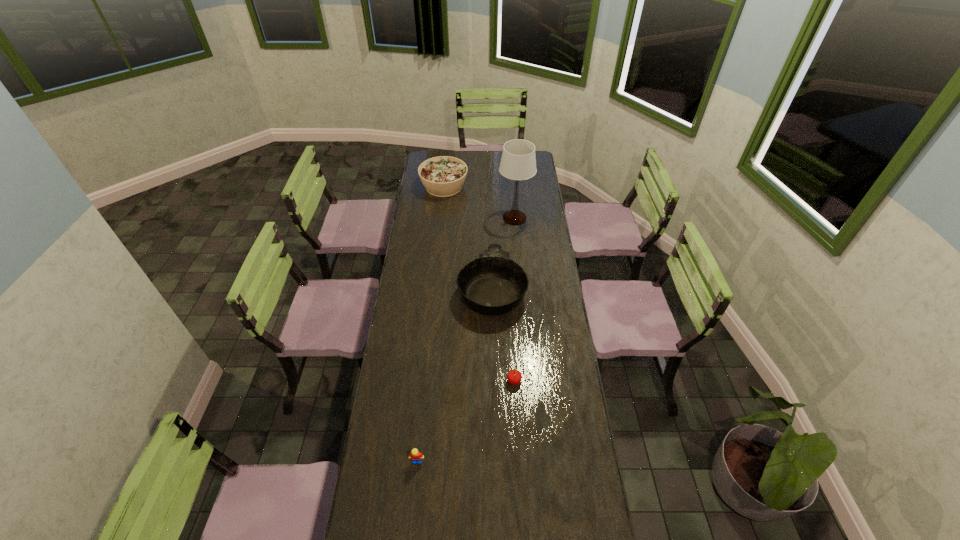
The height and width of the screenshot is (540, 960). I want to click on vacant space located 0.360m with the handle extending from the side of the frying pan, so click(x=490, y=210).

Where is `free space located 0.270m with the handle extending from the side of the frying pan`? Image resolution: width=960 pixels, height=540 pixels. free space located 0.270m with the handle extending from the side of the frying pan is located at coordinates (491, 220).

Where is `vacant space located 0.090m with the handle extending from the side of the frying pan`? vacant space located 0.090m with the handle extending from the side of the frying pan is located at coordinates (491, 243).

Where is `vacant space located on the front of the second nearest object`? The height and width of the screenshot is (540, 960). vacant space located on the front of the second nearest object is located at coordinates (517, 440).

This screenshot has width=960, height=540. In order to click on blank area located 0.100m on the face of the Lego in this screenshot , I will do tap(414, 496).

This screenshot has height=540, width=960. Identify the location of salad present at the left edge. (443, 176).

Identify the location of Lego present at the left edge. (416, 457).

I want to click on table lamp that is positioned at the right edge, so click(518, 162).

Locate an element on the screen. The image size is (960, 540). frying pan that is at the right edge is located at coordinates (493, 284).

Find the location of `free spot at the left edge of the desktop`. free spot at the left edge of the desktop is located at coordinates (396, 461).